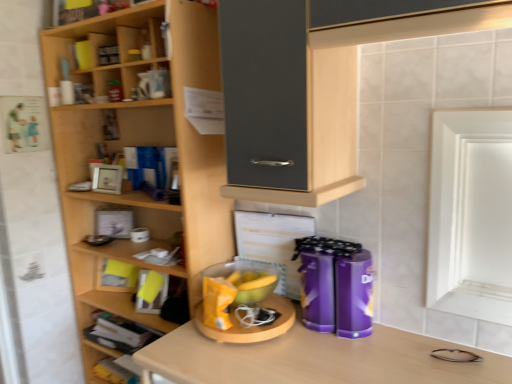
Question: From the image's perspective, is wooden shelf at lower left, which is the 1th shelf from bottom to top, above or below wooden books at lower left, the second shelf positioned from the bottom?

Choices:
 (A) below
 (B) above

Answer: (A)

Question: In terms of width, does wooden shelf at lower left, which is the 1th shelf from bottom to top, look wider or thinner when compared to wooden books at lower left, the second shelf positioned from the bottom?

Choices:
 (A) thin
 (B) wide

Answer: (B)

Question: Which is nearer to the wooden shelf at lower left, acting as the 3th shelf starting from the top?

Choices:
 (A) purple glossy canisters at center, arranged as the first appliance when viewed from the right
 (B) yellow matte bowl at center, the 1th appliance in the left-to-right sequence
 (C) wooden desk at center
 (D) wooden shelves at left, the third shelf positioned from the bottom
 (E) wooden books at lower left, the second shelf positioned from the bottom

Answer: (E)

Question: Considering the real-world distances, which object is farthest from the wooden books at lower left, which ranks as the 2th shelf in top-to-bottom order?

Choices:
 (A) wooden desk at center
 (B) purple glossy canisters at center, placed as the second appliance when sorted from left to right
 (C) yellow matte bowl at center, the second appliance when ordered from right to left
 (D) wooden shelf at lower left, acting as the 3th shelf starting from the top
 (E) wooden shelves at left, the third shelf positioned from the bottom

Answer: (B)